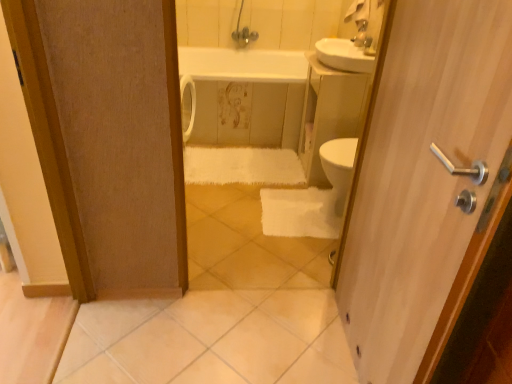
What do you see at coordinates (362, 34) in the screenshot?
I see `metallic silver faucet at upper center` at bounding box center [362, 34].

Describe the element at coordinates (328, 113) in the screenshot. I see `white glossy sink at upper center` at that location.

This screenshot has width=512, height=384. Describe the element at coordinates (426, 183) in the screenshot. I see `wooden door handle at right` at that location.

Identify the location of white glossy sink at upper right. (344, 55).

Image resolution: width=512 pixels, height=384 pixels. I want to click on metallic silver faucet at upper center, so click(x=362, y=34).

Is wooden door handle at right spatially inside metallic silver faucet at upper center, or outside of it?

wooden door handle at right cannot be found inside metallic silver faucet at upper center.

Does wooden door handle at right appear on the right side of metallic silver faucet at upper center?

Incorrect, wooden door handle at right is not on the right side of metallic silver faucet at upper center.

Is wooden door handle at right bigger than metallic silver faucet at upper center?

Yes.

Which is closer to the camera, (392, 90) or (364, 29)?

The point (392, 90) is in front.

From a real-world perspective, is white glossy tile at lower center under white glossy sink at upper right?

Yes, from a real-world perspective, white glossy tile at lower center is under white glossy sink at upper right.

Considering the relative positions of white glossy tile at lower center and white glossy sink at upper right in the image provided, is white glossy tile at lower center to the right of white glossy sink at upper right from the viewer's perspective?

No.

Which of these two, white glossy tile at lower center or white glossy sink at upper right, is bigger?

With larger size is white glossy tile at lower center.

Is metallic silver faucet at upper center surrounded by white glossy tile at lower center?

No, metallic silver faucet at upper center is not surrounded by white glossy tile at lower center.

How many degrees apart are the facing directions of white glossy tile at lower center and metallic silver faucet at upper center?

88.7 degrees separate the facing orientations of white glossy tile at lower center and metallic silver faucet at upper center.

Is white glossy tile at lower center further to the viewer compared to metallic silver faucet at upper center?

No, the depth of white glossy tile at lower center is less than that of metallic silver faucet at upper center.

Is point (260, 323) positioned behind point (366, 31)?

No, (260, 323) is closer to viewer.

Visually, is white glossy bathtub at center positioned to the left or to the right of white glossy tile at lower center?

Clearly, white glossy bathtub at center is on the left of white glossy tile at lower center in the image.

Is there a large distance between white glossy bathtub at center and white glossy tile at lower center?

Yes, white glossy bathtub at center is far from white glossy tile at lower center.

Is white glossy bathtub at center not within white glossy tile at lower center?

white glossy bathtub at center is positioned outside white glossy tile at lower center.

Can you tell me how much white glossy bathtub at center and white glossy sink at upper right differ in facing direction?

89.6 degrees separate the facing orientations of white glossy bathtub at center and white glossy sink at upper right.

In terms of size, does white glossy bathtub at center appear bigger or smaller than white glossy sink at upper right?

white glossy bathtub at center is bigger than white glossy sink at upper right.

From a real-world perspective, which is physically below, white glossy bathtub at center or white glossy sink at upper right?

In real-world perspective, white glossy bathtub at center is lower.

Is the surface of white glossy bathtub at center in direct contact with white glossy sink at upper right?

white glossy bathtub at center and white glossy sink at upper right are clearly separated.

Could you tell me if white glossy sink at upper center is turned towards metallic silver faucet at upper center?

No, white glossy sink at upper center is not facing towards metallic silver faucet at upper center.

Visually, is white glossy sink at upper center positioned to the left or to the right of metallic silver faucet at upper center?

Clearly, white glossy sink at upper center is on the left of metallic silver faucet at upper center in the image.

Is white glossy sink at upper center far away from metallic silver faucet at upper center?

That's not correct — white glossy sink at upper center is a little close to metallic silver faucet at upper center.

Between white glossy sink at upper center and metallic silver faucet at upper center, which one has smaller size?

Smaller between the two is metallic silver faucet at upper center.

Consider the image. From a real-world perspective, is metallic silver faucet at upper center over white glossy tile at lower center?

Indeed, from a real-world perspective, metallic silver faucet at upper center stands above white glossy tile at lower center.

In the scene shown: Is metallic silver faucet at upper center not near white glossy tile at lower center?

Indeed, metallic silver faucet at upper center is not near white glossy tile at lower center.

Based on the photo, which is closer, [362,31] or [140,379]?

Point [362,31].

Does metallic silver faucet at upper center appear on the right side of white glossy tile at lower center?

Yes, metallic silver faucet at upper center is to the right of white glossy tile at lower center.

Image resolution: width=512 pixels, height=384 pixels. What are the coordinates of `door in front of the metallic silver faucet at upper center` in the screenshot? It's located at (426, 183).

The image size is (512, 384). In the image, there is a white glossy tile at lower center. Find the location of `sink above it (from the image's perspective)`. sink above it (from the image's perspective) is located at coordinates (344, 55).

Considering their positions, is metallic silver faucet at upper center positioned further to white glossy bathtub at center than white fluffy bath towel at center?

metallic silver faucet at upper center.

Considering their positions, is white glossy bathtub at center positioned further to wooden door handle at right than white glossy sink at upper center?

The object further to wooden door handle at right is white glossy bathtub at center.

From the image, which object appears to be farther from white glossy tile at lower center, wooden door handle at right or white glossy sink at upper center?

Based on the image, white glossy sink at upper center appears to be further to white glossy tile at lower center.

Estimate the real-world distances between objects in this image. Which object is closer to white fluffy bath towel at center, white glossy sink at upper center or white glossy tile at lower center?

Based on the image, white glossy sink at upper center appears to be nearer to white fluffy bath towel at center.

Estimate the real-world distances between objects in this image. Which object is further from metallic silver faucet at upper center, white glossy bathtub at center or white glossy tile at lower center?

The object further to metallic silver faucet at upper center is white glossy tile at lower center.

Which object lies further to the anchor point white glossy tile at lower center, white fluffy bath towel at center or white glossy sink at upper right?

Among the two, white glossy sink at upper right is located further to white glossy tile at lower center.

Looking at this image, estimate the real-world distances between objects in this image. Which object is further from white glossy sink at upper right, white glossy tile at lower center or metallic silver faucet at upper center?

white glossy tile at lower center is positioned further to the anchor white glossy sink at upper right.

Considering their positions, is metallic silver faucet at upper center positioned closer to white glossy tile at lower center than wooden door handle at right?

wooden door handle at right lies closer to white glossy tile at lower center than the other object.

Find the location of a particular element. counter top between white glossy bathtub at center and metallic silver faucet at upper center from left to right is located at coordinates (328, 113).

The width and height of the screenshot is (512, 384). Find the location of `bath towel between white glossy sink at upper right and white glossy tile at lower center in the up-down direction`. bath towel between white glossy sink at upper right and white glossy tile at lower center in the up-down direction is located at coordinates (242, 166).

Locate an element on the screen. This screenshot has width=512, height=384. bath between white fluffy bath towel at center and white glossy sink at upper right from left to right is located at coordinates (242, 96).

At what (x,y) coordinates should I click in order to perform the action: click on bath between metallic silver faucet at upper center and white glossy tile at lower center in the up-down direction. Please return your answer as a coordinate pair (x, y). Looking at the image, I should click on (242, 96).